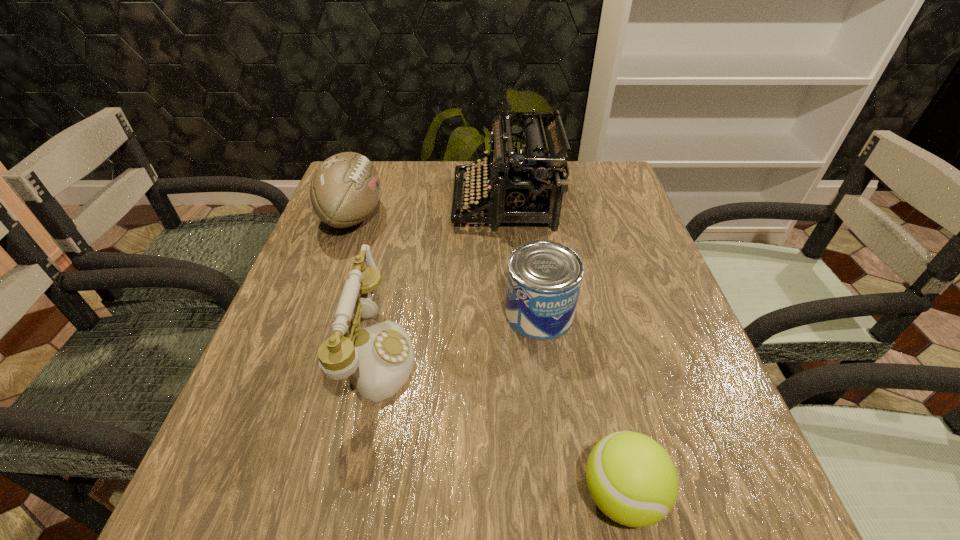
Where is `unoccupied position between the typewriter and the football (American)`? This screenshot has width=960, height=540. unoccupied position between the typewriter and the football (American) is located at coordinates (429, 209).

Find the location of a particular element. The width and height of the screenshot is (960, 540). free spot between the football (American) and the tallest object is located at coordinates pyautogui.click(x=429, y=209).

Locate which object is the closest to the tennis ball. Please provide its 2D coordinates. Your answer should be formatted as a tuple, i.e. [(x, y)], where the tuple contains the x and y coordinates of a point satisfying the conditions above.

[(544, 278)]

Where is `object that is the third closest to the tennis ball`? object that is the third closest to the tennis ball is located at coordinates (532, 181).

You are a GUI agent. You are given a task and a screenshot of the screen. Output one action in this format:
    pyautogui.click(x=<x>, y=<y>)
    Task: Click on the free point that satisfies the following two spatial constraints: 1. on the front label of the can; 2. on the dial of the telephone
    
    Given the screenshot: What is the action you would take?
    pyautogui.click(x=544, y=355)